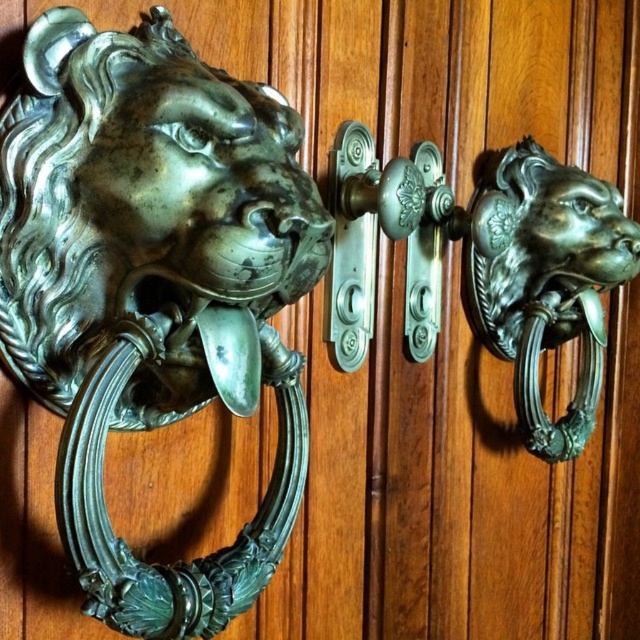
From the picture: Between green patina metal lion head at left and green patina metal lion head knocker at left, which one is positioned lower?

green patina metal lion head knocker at left is lower down.

Does green patina metal lion head at left have a lesser height compared to green patina metal lion head knocker at left?

Incorrect, green patina metal lion head at left's height does not fall short of green patina metal lion head knocker at left's.

What are the coordinates of `green patina metal lion head at left` in the screenshot? It's located at (141, 195).